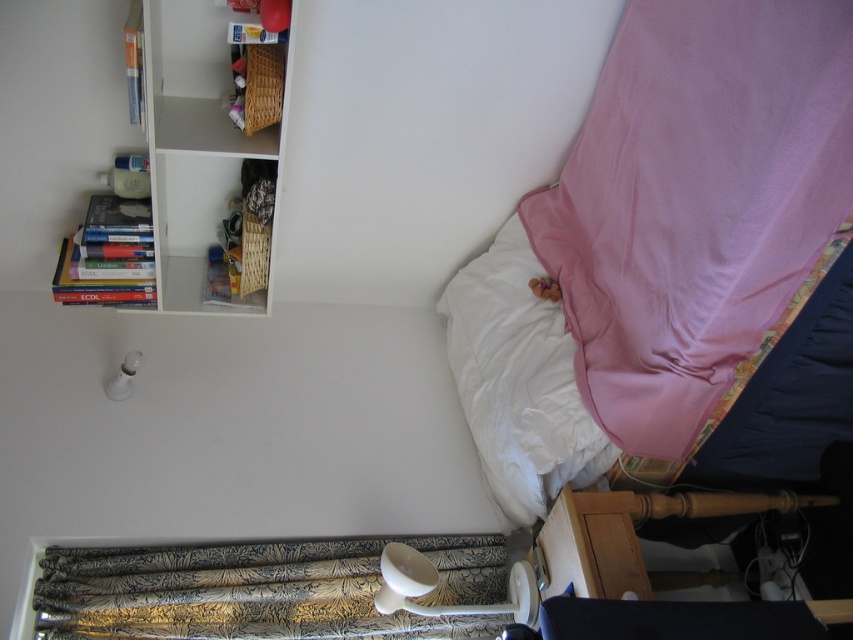
From the picture: You are standing in the bedroom and want to reach the pink fabric curtain at right to open a window. The curtain is 1.18 meters away. If you are 1.6 meters tall, can you comfortably reach the curtain without needing a stool?

The pink fabric curtain at right is 1.18 meters from the camera, which is within a comfortable reaching distance for someone who is 1.6 meters tall. You can reach it without needing a stool.

You are standing in the bedroom and want to hang a new poster. The poster is 1 meter tall. You have two options for placement. One is next to the pink fabric curtain at right, and the other is above the white soft pillow at upper right. Based on the height of the objects, where should you place the poster to ensure it fits without being cut off?

The pink fabric curtain at right is much taller than the white soft pillow at upper right, so the poster should be placed next to the pink fabric curtain at right to ensure it fits without being cut off.

You are standing in the bedroom and want to hang a new painting. The painting is 1 meter wide. Is there enough space between the pink fabric curtain at right and the bed to hang it?

The pink fabric curtain at right is located at point (695, 202), but without knowing the distance between it and the bed, we cannot determine if there is enough space for the painting. Additional information about the distance or positioning is needed to answer this question accurately.